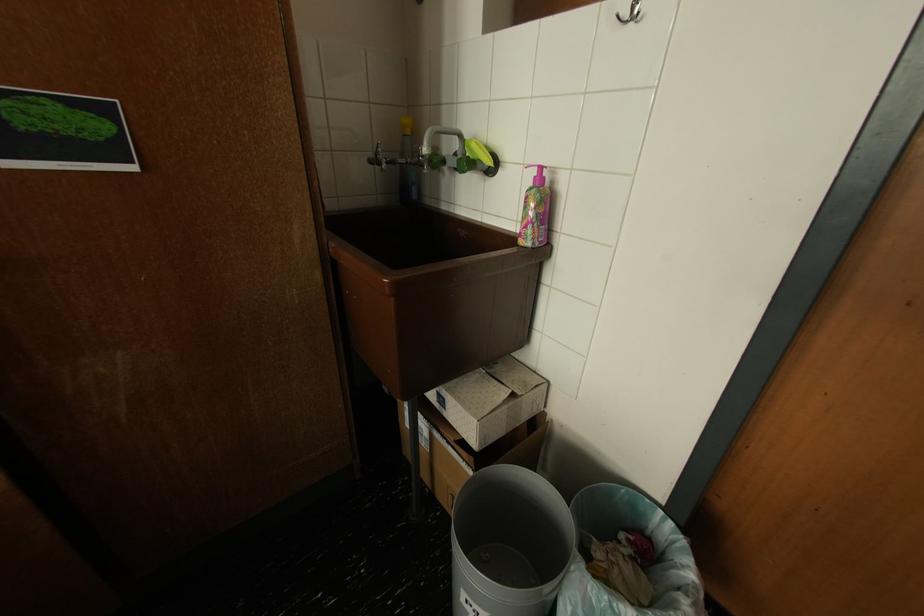
Describe the element at coordinates (443, 150) in the screenshot. The width and height of the screenshot is (924, 616). I see `a faucet spout` at that location.